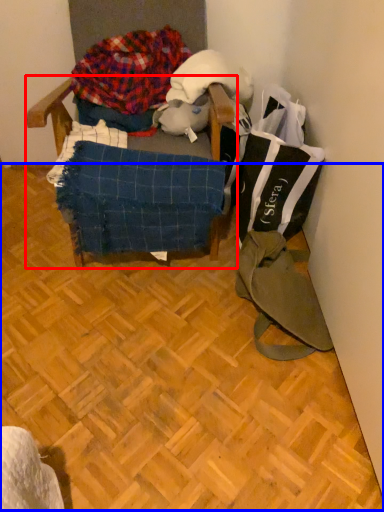
Question: Which point is further to the camera, furniture (highlighted by a red box) or wood (highlighted by a blue box)?

Choices:
 (A) furniture
 (B) wood

Answer: (A)